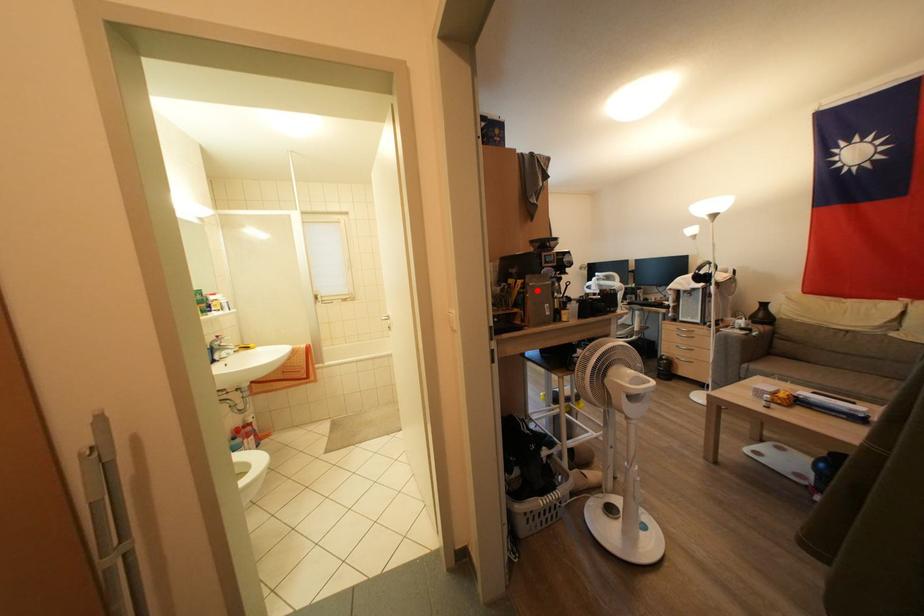
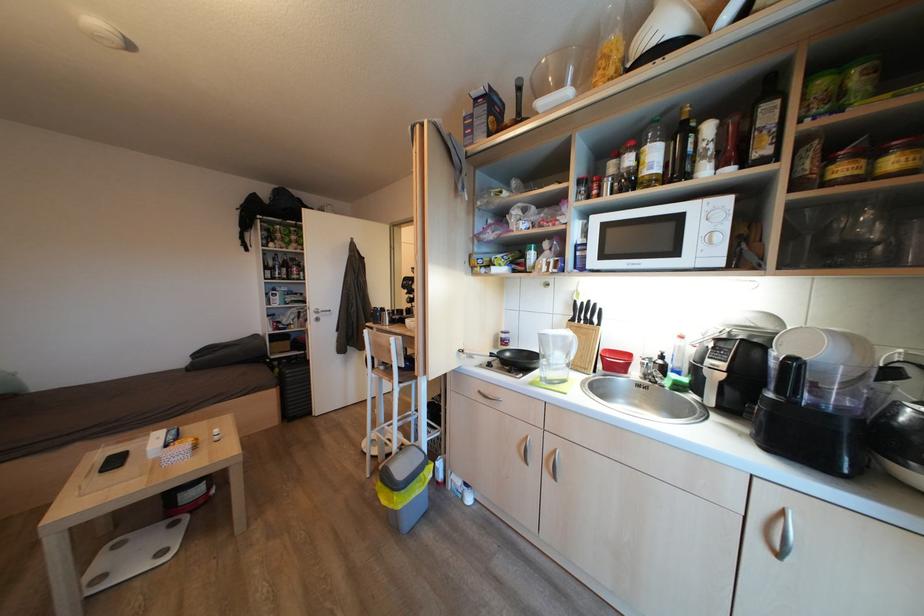
Question: I am providing you with two images of the same scene from different viewpoints. A red point is marked on the first image. Can you still see the location of the red point in image 2?

Choices:
 (A) Yes
 (B) No

Answer: (B)